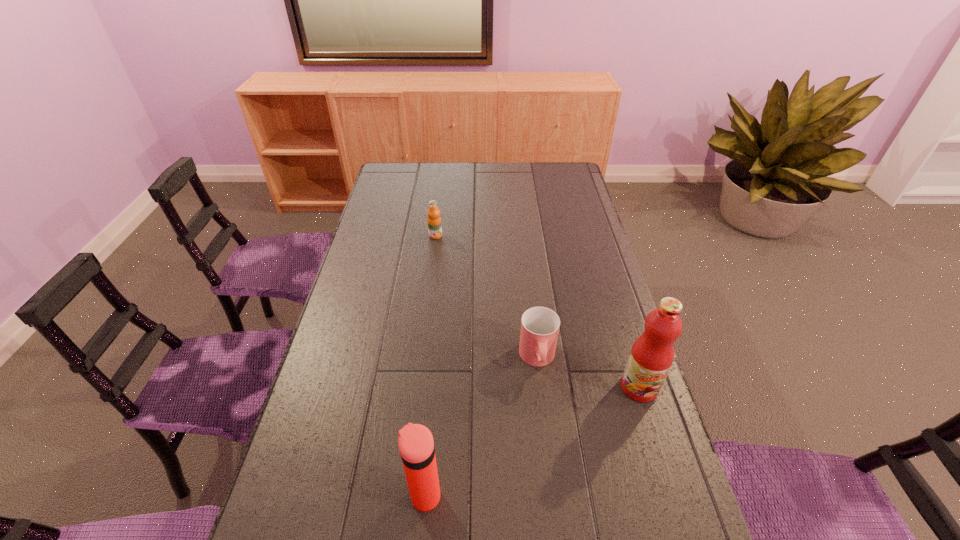
At what (x,y) coordinates should I click in order to perform the action: click on thermos bottle. Please return your answer as a coordinate pair (x, y). This screenshot has width=960, height=540. Looking at the image, I should click on (416, 445).

At what (x,y) coordinates should I click in order to perform the action: click on the third shortest object. Please return your answer as a coordinate pair (x, y). The width and height of the screenshot is (960, 540). Looking at the image, I should click on (416, 445).

The width and height of the screenshot is (960, 540). Identify the location of the rightmost object. (652, 354).

I want to click on the tallest object, so click(652, 354).

Where is `the third object from left to right`? This screenshot has height=540, width=960. the third object from left to right is located at coordinates (540, 326).

Locate an element on the screen. The image size is (960, 540). the farthest object is located at coordinates (434, 220).

This screenshot has width=960, height=540. What are the coordinates of `vacant space located on the back of the nearest object` in the screenshot? It's located at (437, 368).

Find the location of a particular element. This screenshot has height=540, width=960. free space located on the front label of the fruit juice is located at coordinates (678, 509).

At what (x,y) coordinates should I click in order to perform the action: click on free space located on the side of the second object from right to left with the handle. Please return your answer as a coordinate pair (x, y). Looking at the image, I should click on tap(543, 407).

Where is `vacant space located 0.150m on the side of the second object from right to left with the handle`? vacant space located 0.150m on the side of the second object from right to left with the handle is located at coordinates (546, 432).